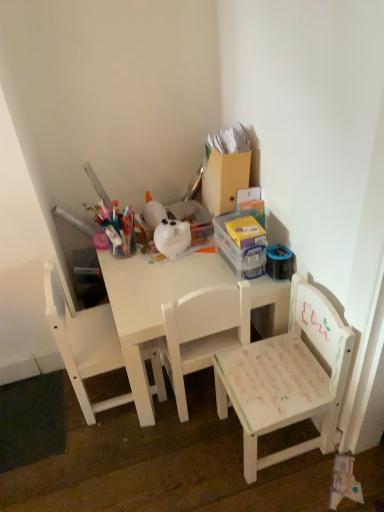
Locate an element on the screen. Image resolution: width=384 pixels, height=512 pixels. vacant space situated on the left part of white painted wood chair at lower right, which appears as the 3th chair when viewed from the left is located at coordinates (185, 457).